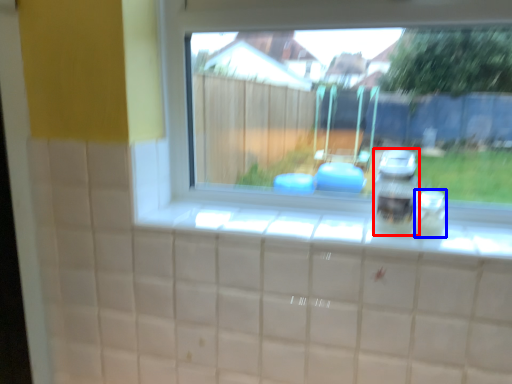
Question: Which object is further to the camera taking this photo, appliance (highlighted by a red box) or glass jar (highlighted by a blue box)?

Choices:
 (A) appliance
 (B) glass jar

Answer: (B)